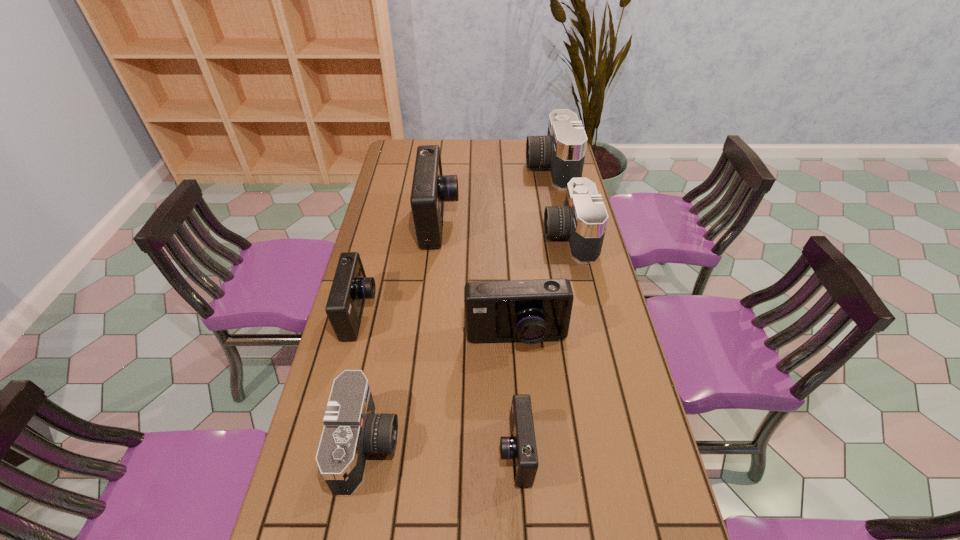
The height and width of the screenshot is (540, 960). Find the location of `the second blue camera from left to right`. the second blue camera from left to right is located at coordinates 430,189.

Locate an element on the screen. The image size is (960, 540). the farthest blue camera is located at coordinates (430, 189).

Locate an element on the screen. the farthest camera is located at coordinates (563, 150).

Where is `the farthest black camera`? The width and height of the screenshot is (960, 540). the farthest black camera is located at coordinates (563, 150).

The image size is (960, 540). What are the coordinates of `the third smallest blue camera` in the screenshot? It's located at (531, 311).

The image size is (960, 540). Find the location of `the second farthest black camera`. the second farthest black camera is located at coordinates (583, 220).

Find the location of `the third biggest blue camera`. the third biggest blue camera is located at coordinates (350, 287).

I want to click on the leftmost black camera, so click(x=352, y=429).

You are a GUI agent. You are given a task and a screenshot of the screen. Output one action in this format:
    pyautogui.click(x=<x>, y=<y>)
    Task: Click on the nearest black camera
    The image size is (960, 540).
    Given the screenshot: What is the action you would take?
    pyautogui.click(x=352, y=429)

Identify the location of the shortest camera. (521, 446).